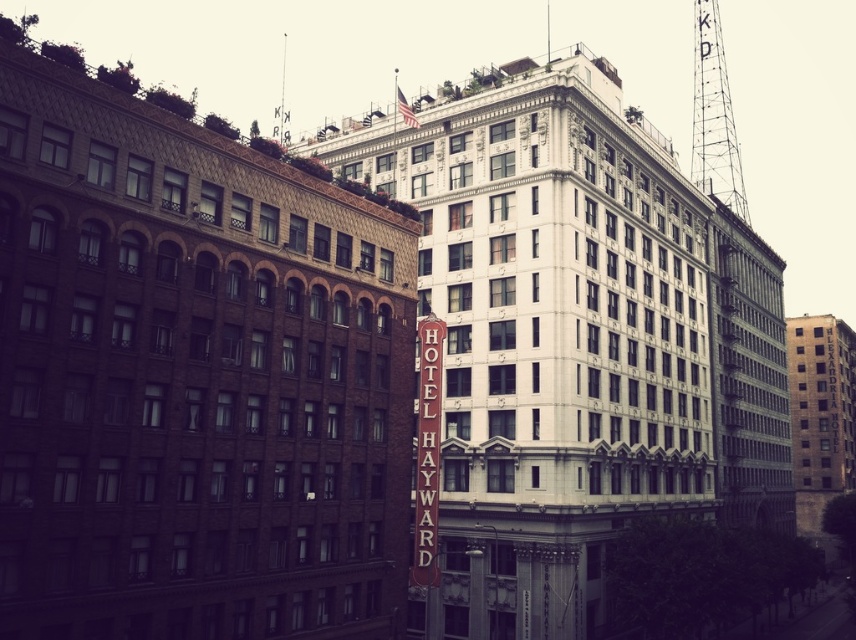
You are a drone operator trying to navigate between two points in the city. You have to fly from point A to point B. If point A is located at point A is the point at [800,451] and point B is at point B is the point at [428,362], will you fly over the tall dark brown brick building or the white building during your flight path?

Since point A at [800,451] is behind point B at [428,362], the flight path from point A to point B would pass behind the tall dark brown brick building on the left and the white building in the center right. However, the exact building obstructing the path depends on their positions. The white building is centrally located, so the drone might fly over it.

You are a tourist standing in the city square looking at the scene. You see the metallic tower at upper right and the brown wooden sign at center. Which object is located to the right of the other?

The metallic tower at upper right is positioned on the right side of brown wooden sign at center.